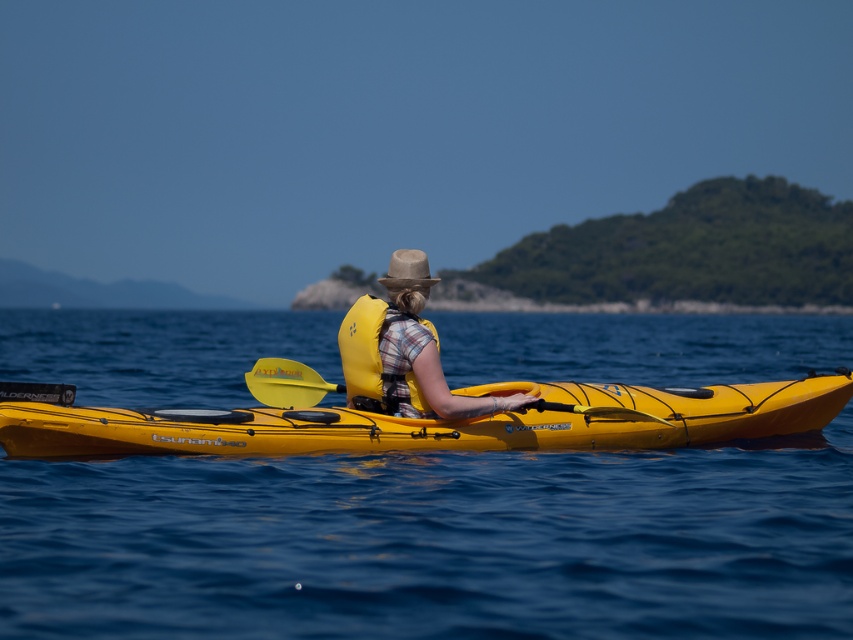
Question: Which of these objects is positioned closest to the transparent blue water at center?

Choices:
 (A) yellow matte life vest at center
 (B) yellow matte paddle at center
 (C) yellow matte kayak at center

Answer: (A)

Question: Can you confirm if yellow matte kayak at center is bigger than gray felt cowboy hat at center?

Choices:
 (A) no
 (B) yes

Answer: (B)

Question: Does yellow matte kayak at center have a larger size compared to yellow matte life vest at center?

Choices:
 (A) no
 (B) yes

Answer: (B)

Question: Does yellow fabric life jacket at center lie in front of gray felt cowboy hat at center?

Choices:
 (A) no
 (B) yes

Answer: (B)

Question: Among these points, which one is nearest to the camera?

Choices:
 (A) (404, 273)
 (B) (64, 392)
 (C) (413, 275)
 (D) (355, 326)

Answer: (B)

Question: Among these points, which one is nearest to the camera?

Choices:
 (A) (602, 426)
 (B) (396, 387)

Answer: (B)